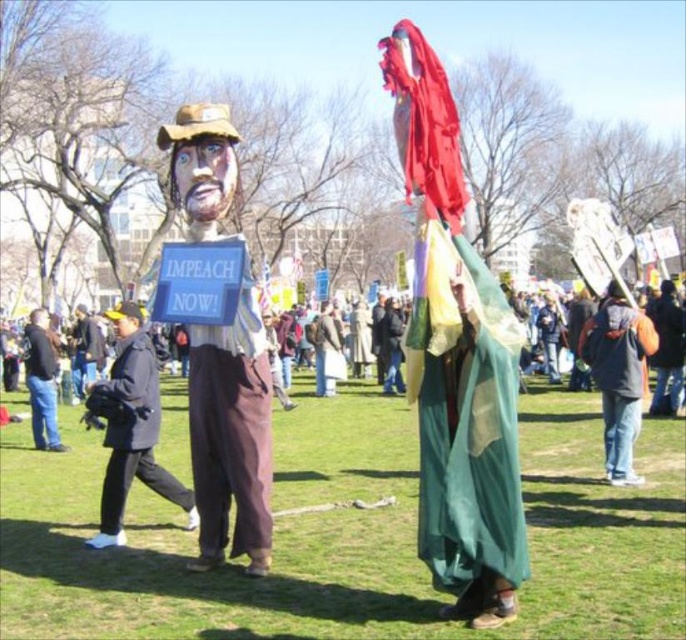
Does matte cardboard figure at center come in front of black fabric jacket at left?

Yes, it is.

Which of these two, matte cardboard figure at center or black fabric jacket at left, stands taller?

matte cardboard figure at center

This screenshot has height=640, width=686. What are the coordinates of `matte cardboard figure at center` in the screenshot? It's located at (230, 436).

Which is above, jeans at left or dark blue fabric at center?

Positioned higher is jeans at left.

Who is shorter, jeans at left or dark blue fabric at center?

Standing shorter between the two is dark blue fabric at center.

Who is more distant from viewer, [32,426] or [82,353]?

The point [82,353] is behind.

Find the location of a particular element. Image resolution: width=686 pixels, height=640 pixels. jeans at left is located at coordinates (40, 380).

Does matte cardboard figure at center lie in front of jeans at left?

Yes, it is in front of jeans at left.

Which is in front, point (263, 456) or point (43, 348)?

Point (263, 456) is in front.

Which is behind, point (215, 173) or point (38, 404)?

The point (38, 404) is behind.

Identify the location of matte cardboard figure at center. Image resolution: width=686 pixels, height=640 pixels. pos(230,436).